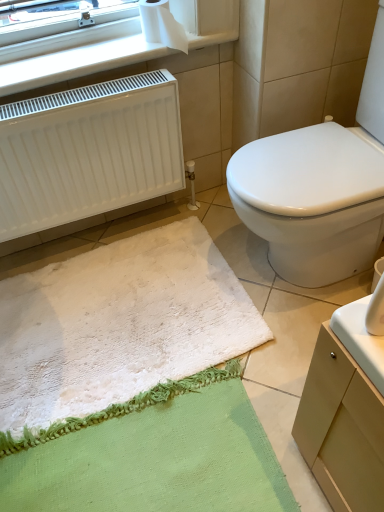
Question: Is white plastic radiator at upper left oriented towards white fluffy bath mat at lower left?

Choices:
 (A) yes
 (B) no

Answer: (B)

Question: Considering the relative sizes of white plastic radiator at upper left and white fluffy bath mat at lower left in the image provided, is white plastic radiator at upper left wider than white fluffy bath mat at lower left?

Choices:
 (A) yes
 (B) no

Answer: (B)

Question: Is white plastic radiator at upper left to the right of white fluffy bath mat at lower left from the viewer's perspective?

Choices:
 (A) yes
 (B) no

Answer: (A)

Question: Is white plastic radiator at upper left further to camera compared to white fluffy bath mat at lower left?

Choices:
 (A) yes
 (B) no

Answer: (A)

Question: Does white plastic radiator at upper left have a lesser width compared to white fluffy bath mat at lower left?

Choices:
 (A) no
 (B) yes

Answer: (B)

Question: Is white plastic radiator at upper left beside white fluffy bath mat at lower left?

Choices:
 (A) yes
 (B) no

Answer: (B)

Question: From the image's perspective, does white glossy toilet at center appear lower than white matte radiator at left?

Choices:
 (A) yes
 (B) no

Answer: (A)

Question: Is the depth of white glossy toilet at center greater than that of white matte radiator at left?

Choices:
 (A) no
 (B) yes

Answer: (A)

Question: Is white glossy toilet at center looking in the opposite direction of white matte radiator at left?

Choices:
 (A) yes
 (B) no

Answer: (B)

Question: From the image's perspective, is white glossy toilet at center over white matte radiator at left?

Choices:
 (A) no
 (B) yes

Answer: (A)

Question: Is white glossy toilet at center completely or partially outside of white matte radiator at left?

Choices:
 (A) yes
 (B) no

Answer: (A)

Question: From a real-world perspective, is white glossy toilet at center under white matte radiator at left?

Choices:
 (A) yes
 (B) no

Answer: (B)

Question: Is white glossy toilet at center located within white paper at upper left?

Choices:
 (A) yes
 (B) no

Answer: (B)